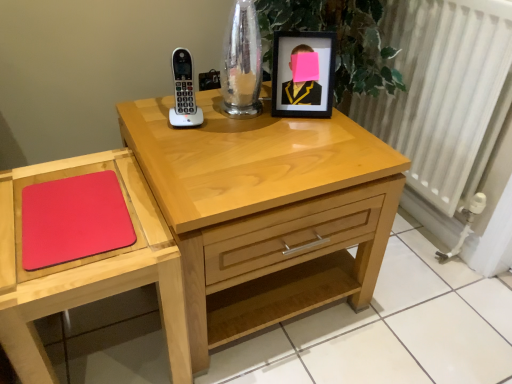
Question: Is white textured radiator at right positioned behind rubberized red mousepad at lower left?

Choices:
 (A) yes
 (B) no

Answer: (A)

Question: Is white textured radiator at right at the right side of rubberized red mousepad at lower left?

Choices:
 (A) no
 (B) yes

Answer: (B)

Question: From the image's perspective, is white textured radiator at right beneath rubberized red mousepad at lower left?

Choices:
 (A) no
 (B) yes

Answer: (A)

Question: Is the position of white textured radiator at right less distant than that of rubberized red mousepad at lower left?

Choices:
 (A) no
 (B) yes

Answer: (A)

Question: Is white textured radiator at right smaller than rubberized red mousepad at lower left?

Choices:
 (A) yes
 (B) no

Answer: (B)

Question: Is white textured radiator at right thinner than rubberized red mousepad at lower left?

Choices:
 (A) no
 (B) yes

Answer: (B)

Question: Is light wood nightstand at center oriented towards black matte picture frame at upper right?

Choices:
 (A) no
 (B) yes

Answer: (A)

Question: Can you confirm if light wood nightstand at center is positioned to the right of black matte picture frame at upper right?

Choices:
 (A) yes
 (B) no

Answer: (B)

Question: Are light wood nightstand at center and black matte picture frame at upper right located far from each other?

Choices:
 (A) no
 (B) yes

Answer: (A)

Question: From a real-world perspective, is light wood nightstand at center below black matte picture frame at upper right?

Choices:
 (A) no
 (B) yes

Answer: (B)

Question: From the image's perspective, is light wood nightstand at center over black matte picture frame at upper right?

Choices:
 (A) yes
 (B) no

Answer: (B)

Question: Can you confirm if light wood nightstand at center is thinner than black matte picture frame at upper right?

Choices:
 (A) yes
 (B) no

Answer: (B)

Question: Considering the relative positions of white textured radiator at right and black matte picture frame at upper right in the image provided, is white textured radiator at right to the right of black matte picture frame at upper right from the viewer's perspective?

Choices:
 (A) no
 (B) yes

Answer: (B)